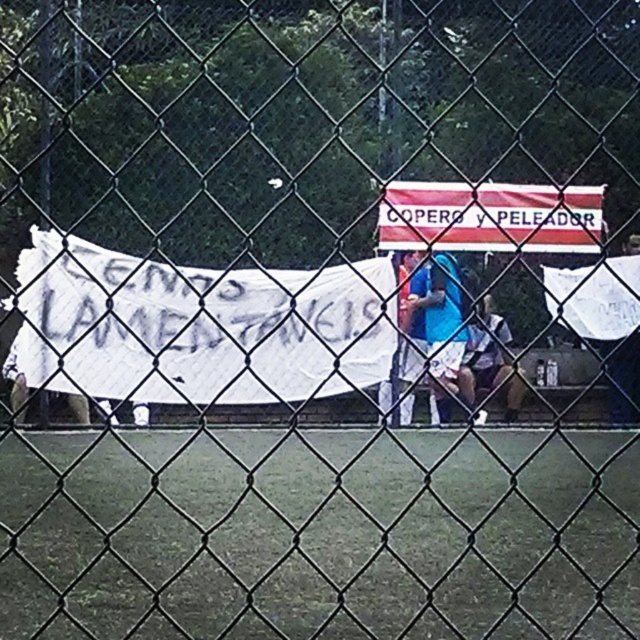
Describe the element at coordinates (196, 326) in the screenshot. The image size is (640, 640). I see `white paper banner at center` at that location.

Who is more forward, (253, 401) or (449, 273)?

Point (253, 401)

Find the location of a particular element. The height and width of the screenshot is (640, 640). white paper banner at center is located at coordinates (196, 326).

At what (x,y) coordinates should I click in order to perform the action: click on white paper banner at center. Please return your answer as a coordinate pair (x, y). Image resolution: width=640 pixels, height=640 pixels. Looking at the image, I should click on (196, 326).

Is blue fabric shirt at center further to the viewer compared to white fabric shirt at center?

No.

Who is higher up, blue fabric shirt at center or white fabric shirt at center?

blue fabric shirt at center is higher up.

The height and width of the screenshot is (640, 640). I want to click on blue fabric shirt at center, so click(x=445, y=330).

Which is above, white paper banner at center or white fabric shirt at center?

Positioned higher is white paper banner at center.

Is point (250, 292) closer to camera compared to point (477, 342)?

Yes, point (250, 292) is in front of point (477, 342).

At what (x,y) coordinates should I click in order to perform the action: click on white paper banner at center. Please return your answer as a coordinate pair (x, y). This screenshot has height=640, width=640. Looking at the image, I should click on (196, 326).

Identify the location of white paper banner at center. The height and width of the screenshot is (640, 640). [x=196, y=326].